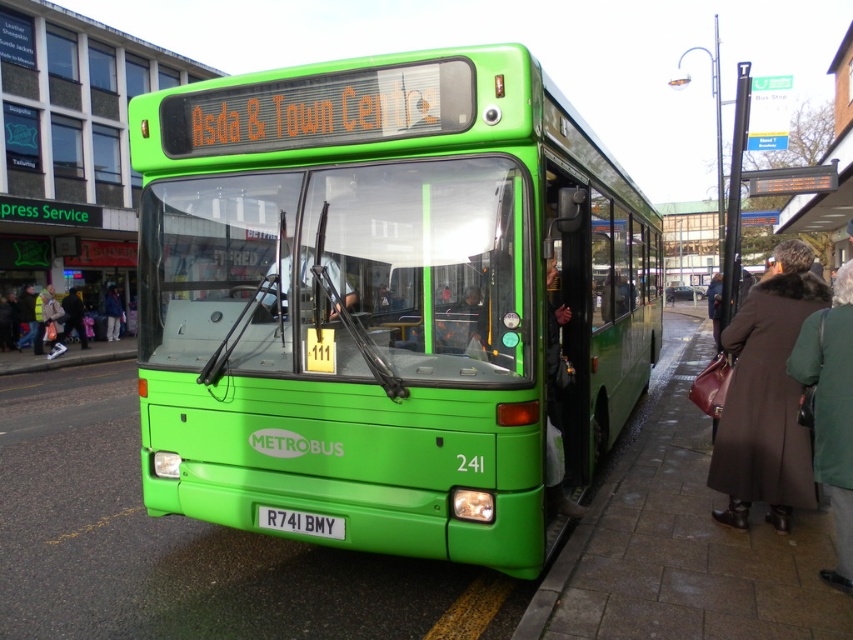
Question: Which of the following is the farthest from the observer?

Choices:
 (A) (782, 260)
 (B) (293, 531)
 (C) (112, 300)
 (D) (44, 352)

Answer: (C)

Question: Where is green matte bus at center located in relation to brown fur coat at right in the image?

Choices:
 (A) above
 (B) below

Answer: (A)

Question: Which object is farther from the camera taking this photo?

Choices:
 (A) brown fur coat at right
 (B) green matte bus at center

Answer: (B)

Question: Which object appears farthest from the camera in this image?

Choices:
 (A) green fabric coat at right
 (B) white plastic license plate at center

Answer: (B)

Question: Can you confirm if yellow reflective jacket at lower left is positioned to the right of dark blue jacket at center?

Choices:
 (A) no
 (B) yes

Answer: (B)

Question: Is green fabric coat at right in front of yellow reflective jacket at lower left?

Choices:
 (A) no
 (B) yes

Answer: (B)